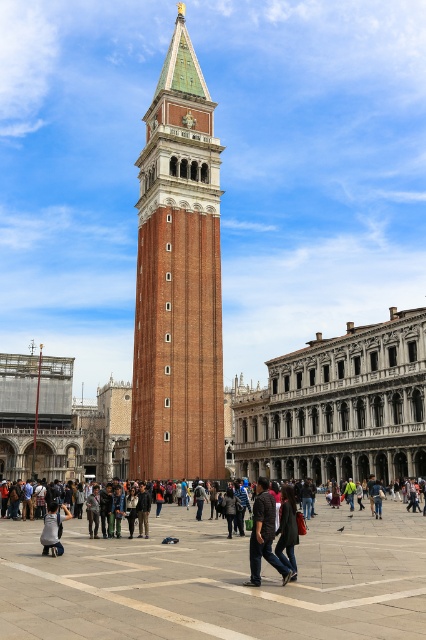
Question: Which is farther from the concrete paving at center?

Choices:
 (A) dark brown leather jacket at center
 (B) brown brick tower at center
 (C) dark gray fabric coat at center
 (D) gray fabric jacket at center

Answer: (B)

Question: Which object appears farthest from the camera in this image?

Choices:
 (A) dark brown leather jacket at center
 (B) concrete paving at center
 (C) dark gray fabric coat at center

Answer: (C)

Question: Is concrete paving at center to the right of gray fabric jacket at center from the viewer's perspective?

Choices:
 (A) no
 (B) yes

Answer: (B)

Question: Where is brown brick tower at center located in relation to gray fabric jacket at center in the image?

Choices:
 (A) right
 (B) left

Answer: (A)

Question: Which point is closer to the camera?

Choices:
 (A) (267, 540)
 (B) (279, 522)
 (C) (52, 524)

Answer: (A)

Question: Does concrete paving at center appear on the right side of dark gray fabric coat at center?

Choices:
 (A) yes
 (B) no

Answer: (B)